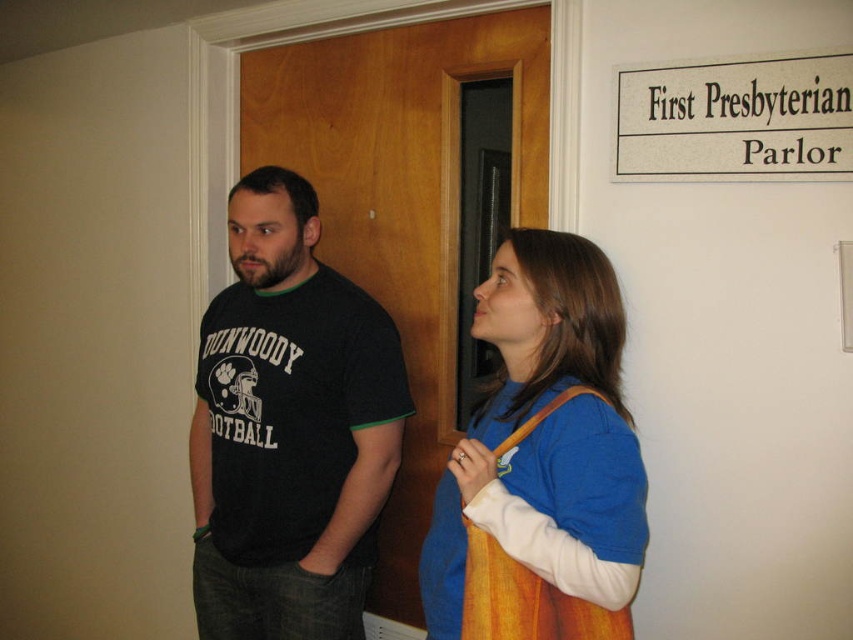
Question: Observing the image, what is the correct spatial positioning of blue fabric shirt at center in reference to brown leather apron at center?

Choices:
 (A) below
 (B) above

Answer: (B)

Question: Which point is farther to the camera?

Choices:
 (A) (469, 538)
 (B) (851, 136)
 (C) (250, 540)

Answer: (C)

Question: Among these points, which one is farthest from the camera?

Choices:
 (A) (354, 220)
 (B) (740, 77)
 (C) (366, 481)
 (D) (540, 616)

Answer: (A)

Question: Is black cotton t-shirt at center to the left of brown leather apron at center from the viewer's perspective?

Choices:
 (A) no
 (B) yes

Answer: (B)

Question: Is black cotton t-shirt at center bigger than brown leather apron at center?

Choices:
 (A) no
 (B) yes

Answer: (B)

Question: Which of the following is the closest to the observer?

Choices:
 (A) brown leather apron at center
 (B) wooden door at center
 (C) black cotton t-shirt at center
 (D) white paper sign at upper right

Answer: (A)